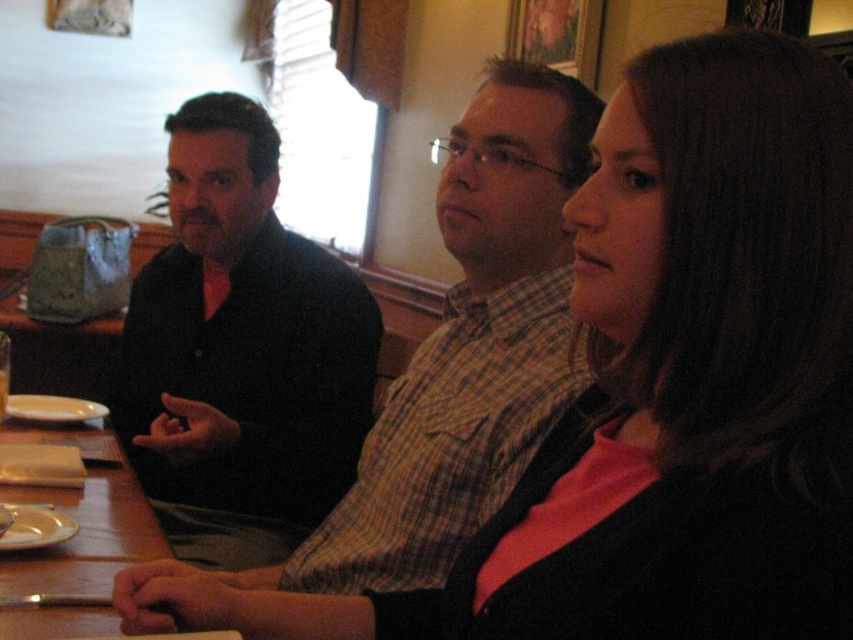
Question: Does black matte shirt at left appear on the right side of wooden table at lower left?

Choices:
 (A) no
 (B) yes

Answer: (B)

Question: Which of the following is the closest to the observer?

Choices:
 (A) black matte shirt at left
 (B) white matte plate at lower left
 (C) wooden table at lower left

Answer: (C)

Question: Which point is farther to the camera?

Choices:
 (A) (257, 433)
 (B) (24, 518)
 (C) (41, 401)

Answer: (C)

Question: Can you confirm if wooden table at lower left is positioned to the right of white matte plate at lower left?

Choices:
 (A) yes
 (B) no

Answer: (A)

Question: Among these objects, which one is farthest from the camera?

Choices:
 (A) wooden table at lower left
 (B) white matte plate at lower left
 (C) black matte shirt at left
 (D) white glossy plate at lower left

Answer: (B)

Question: Can you confirm if black matte shirt at left is positioned above white matte plate at lower left?

Choices:
 (A) yes
 (B) no

Answer: (A)